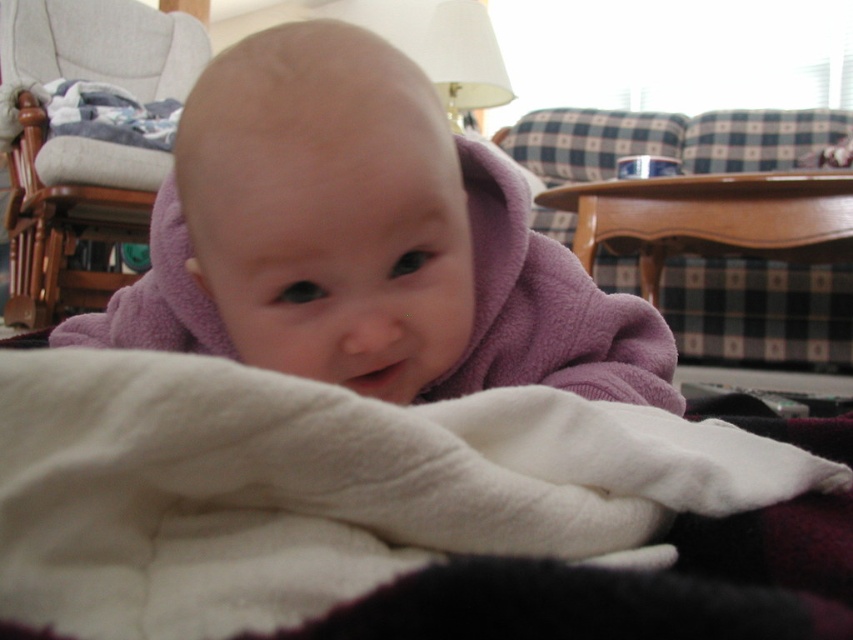
Question: Which object appears farthest from the camera in this image?

Choices:
 (A) fluffy gray blanket at upper left
 (B) gray fabric rocking chair at upper left

Answer: (A)

Question: Can you confirm if purple fleece baby at center is positioned to the right of gray fabric rocking chair at upper left?

Choices:
 (A) yes
 (B) no

Answer: (A)

Question: Which point is farther from the camera taking this photo?

Choices:
 (A) (42, 35)
 (B) (520, 456)
 (C) (350, 131)

Answer: (A)

Question: Is white fleece blanket at center wider than fluffy gray blanket at upper left?

Choices:
 (A) yes
 (B) no

Answer: (B)

Question: Where is purple fleece baby at center located in relation to fluffy gray blanket at upper left in the image?

Choices:
 (A) left
 (B) right

Answer: (B)

Question: Which object is the closest to the purple fleece baby at center?

Choices:
 (A) gray fabric rocking chair at upper left
 (B) fluffy gray blanket at upper left

Answer: (A)